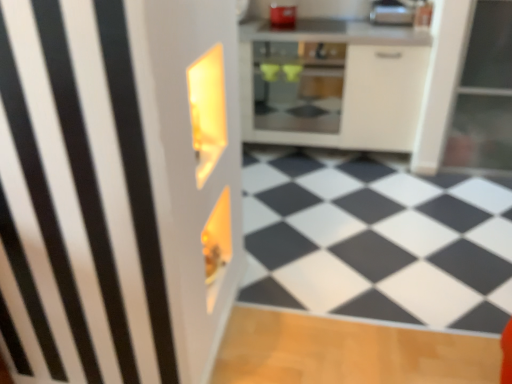
Question: Would you say silver metallic toaster at upper right, which ranks as the first appliance in right-to-left order, is outside metallic silver toaster at upper center, which is the second appliance in right-to-left order?

Choices:
 (A) no
 (B) yes

Answer: (B)

Question: Considering the relative sizes of silver metallic toaster at upper right, which ranks as the first appliance in right-to-left order, and metallic silver toaster at upper center, positioned as the 1th appliance in left-to-right order, in the image provided, is silver metallic toaster at upper right, which ranks as the first appliance in right-to-left order, bigger than metallic silver toaster at upper center, positioned as the 1th appliance in left-to-right order,?

Choices:
 (A) no
 (B) yes

Answer: (B)

Question: Is silver metallic toaster at upper right, which ranks as the first appliance in right-to-left order, next to metallic silver toaster at upper center, which is the second appliance in right-to-left order, and touching it?

Choices:
 (A) no
 (B) yes

Answer: (A)

Question: Can you confirm if silver metallic toaster at upper right, which ranks as the first appliance in right-to-left order, is positioned to the right of metallic silver toaster at upper center, which is the second appliance in right-to-left order?

Choices:
 (A) no
 (B) yes

Answer: (B)

Question: Can you confirm if silver metallic toaster at upper right, the 2th appliance when ordered from left to right, is taller than metallic silver toaster at upper center, positioned as the 1th appliance in left-to-right order?

Choices:
 (A) yes
 (B) no

Answer: (A)

Question: Is silver metallic toaster at upper right, the 2th appliance when ordered from left to right, wider than metallic silver toaster at upper center, which is the second appliance in right-to-left order?

Choices:
 (A) no
 (B) yes

Answer: (A)

Question: From the image's perspective, is metallic silver toaster at upper center, which is the second appliance in right-to-left order, over white glossy cabinet at center?

Choices:
 (A) yes
 (B) no

Answer: (A)

Question: Considering the relative sizes of metallic silver toaster at upper center, positioned as the 1th appliance in left-to-right order, and white glossy cabinet at center in the image provided, is metallic silver toaster at upper center, positioned as the 1th appliance in left-to-right order, wider than white glossy cabinet at center?

Choices:
 (A) no
 (B) yes

Answer: (A)

Question: Are metallic silver toaster at upper center, positioned as the 1th appliance in left-to-right order, and white glossy cabinet at center far apart?

Choices:
 (A) yes
 (B) no

Answer: (B)

Question: Considering the relative positions of metallic silver toaster at upper center, which is the second appliance in right-to-left order, and white glossy cabinet at center in the image provided, is metallic silver toaster at upper center, which is the second appliance in right-to-left order, in front of white glossy cabinet at center?

Choices:
 (A) yes
 (B) no

Answer: (B)

Question: Is metallic silver toaster at upper center, positioned as the 1th appliance in left-to-right order, to the right of white glossy cabinet at center from the viewer's perspective?

Choices:
 (A) no
 (B) yes

Answer: (A)

Question: Is metallic silver toaster at upper center, which is the second appliance in right-to-left order, at the left side of white glossy cabinet at center?

Choices:
 (A) yes
 (B) no

Answer: (A)

Question: Is silver metallic toaster at upper right, which ranks as the first appliance in right-to-left order, further to camera compared to white glossy cabinet at center?

Choices:
 (A) no
 (B) yes

Answer: (B)